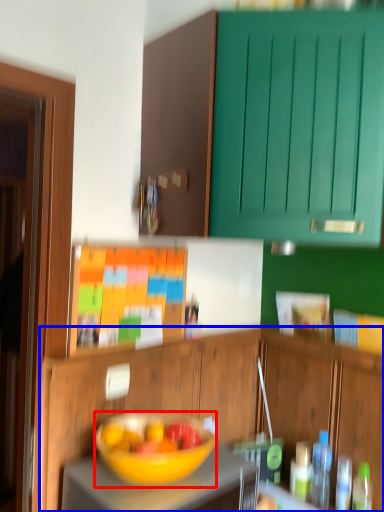
Question: Which object appears farthest to the camera in this image, bowl (highlighted by a red box) or cabinetry (highlighted by a blue box)?

Choices:
 (A) bowl
 (B) cabinetry

Answer: (B)